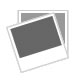
Where is `picture`? Image resolution: width=80 pixels, height=80 pixels. picture is located at coordinates (35, 35).